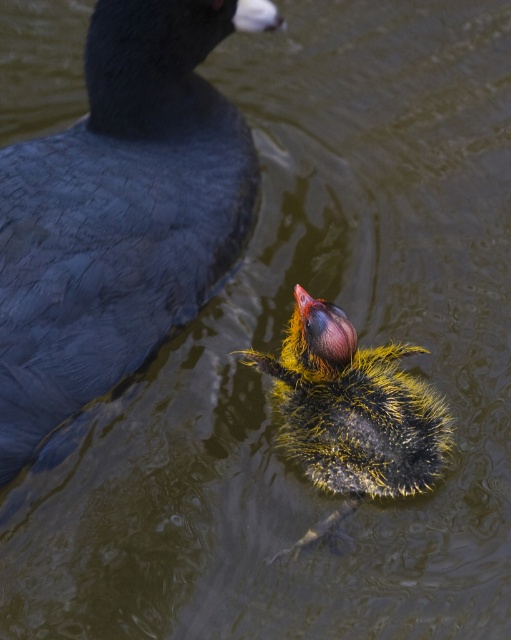
Can you confirm if dark blue feathers at upper left is positioned above yellow downy feather at center?

Indeed, dark blue feathers at upper left is positioned over yellow downy feather at center.

Where is `dark blue feathers at upper left`? The width and height of the screenshot is (511, 640). dark blue feathers at upper left is located at coordinates (119, 216).